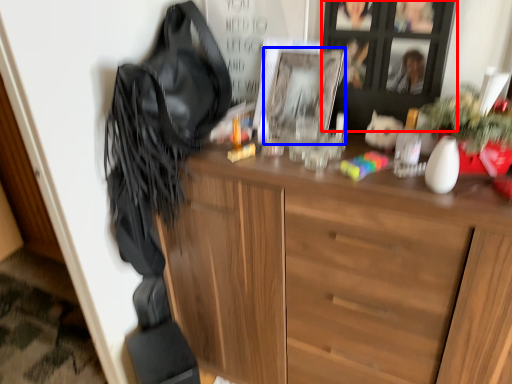
Question: Which of the following is the farthest to the observer, cabinetry (highlighted by a red box) or picture frame (highlighted by a blue box)?

Choices:
 (A) cabinetry
 (B) picture frame

Answer: (B)